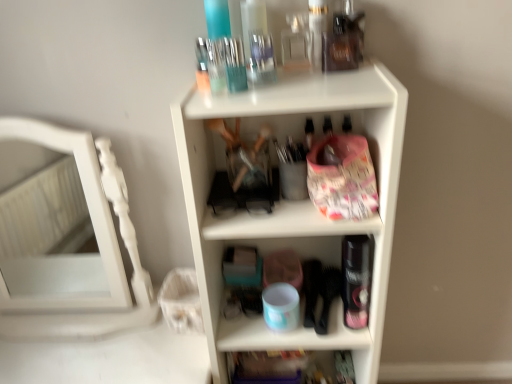
Find the location of a particular element. vacant space in front of white wooden mirror at left is located at coordinates 59,356.